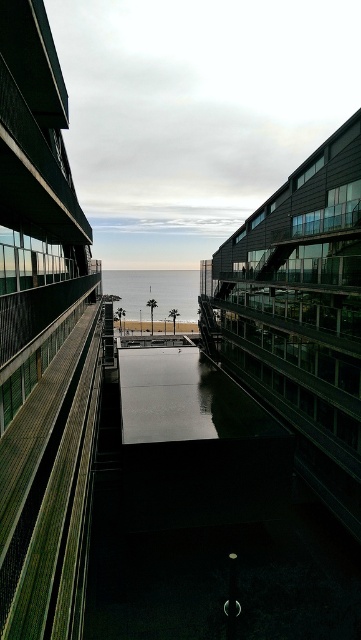
From the picture: You are standing on the balcony looking at the scene. There are two points marked in the image. Which point, point (131, 392) or point (132, 291), is closer to you?

Point (131, 392) is closer to you than point (132, 291).

You are standing on the balcony of the modern building and want to take a photo of both the black glass waterway at center and the blue glossy water at center. Which one should you pan your camera to the right to capture first?

The black glass waterway at center is positioned on the right side of blue glossy water at center. So to capture both, you should pan your camera to the right first to include the black glass waterway at center after the blue glossy water at center.